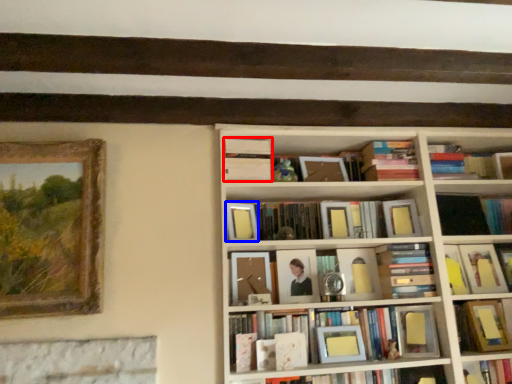
Question: Which of the following is the farthest to the observer, book (highlighted by a red box) or paperback book (highlighted by a blue box)?

Choices:
 (A) book
 (B) paperback book

Answer: (A)